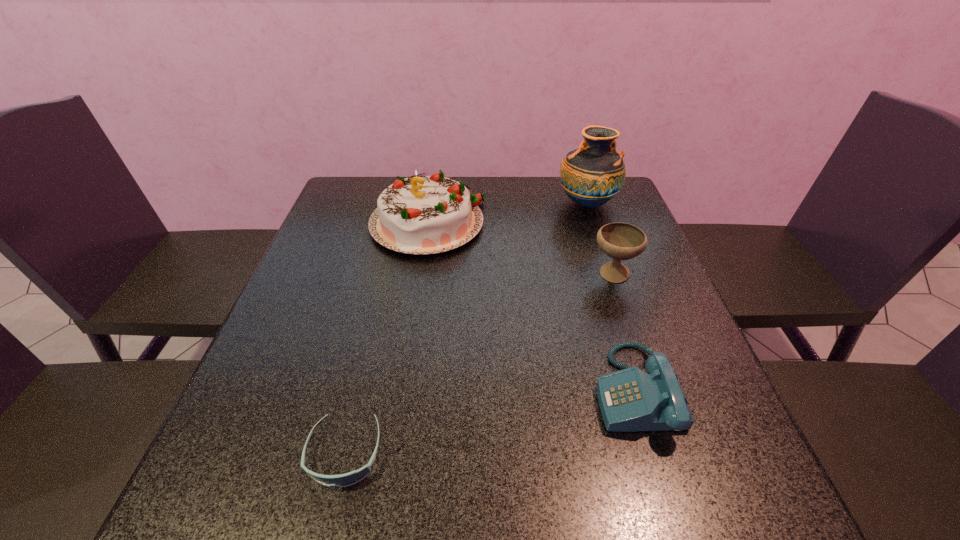
The width and height of the screenshot is (960, 540). What are the coordinates of `free space located 0.340m on the dial of the fourth tallest object` in the screenshot? It's located at (414, 390).

Find the location of a particular element. The image size is (960, 540). vacant space located 0.180m on the dial of the fourth tallest object is located at coordinates (499, 390).

Locate an element on the screen. pottery positioned at the far edge is located at coordinates (593, 174).

The image size is (960, 540). Identify the location of cake at the far edge. (420, 215).

Find the location of `object present at the near edge`. object present at the near edge is located at coordinates (347, 479).

I want to click on cake present at the left edge, so click(x=420, y=215).

Locate an element on the screen. goggles at the left edge is located at coordinates (347, 479).

You are a GUI agent. You are given a task and a screenshot of the screen. Output one action in this format:
    pyautogui.click(x=<x>, y=<y>)
    Task: Click on the pottery present at the right edge
    Image resolution: width=960 pixels, height=540 pixels.
    Given the screenshot: What is the action you would take?
    pyautogui.click(x=593, y=174)

Find the location of a particular element. Image resolution: width=960 pixels, height=540 pixels. chalice at the right edge is located at coordinates (621, 241).

The image size is (960, 540). Identify the location of telephone at the right edge. (630, 400).